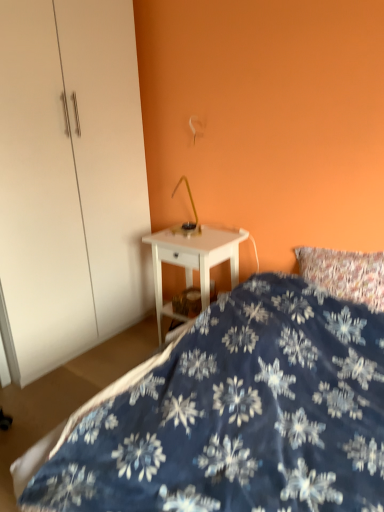
Question: Considering the relative sizes of white glossy dresser at center and blue fabric bed at lower right in the image provided, is white glossy dresser at center smaller than blue fabric bed at lower right?

Choices:
 (A) no
 (B) yes

Answer: (A)

Question: From the image's perspective, is white glossy dresser at center below blue fabric bed at lower right?

Choices:
 (A) yes
 (B) no

Answer: (B)

Question: Are white glossy dresser at center and blue fabric bed at lower right making contact?

Choices:
 (A) yes
 (B) no

Answer: (B)

Question: Is the depth of white glossy dresser at center less than that of blue fabric bed at lower right?

Choices:
 (A) yes
 (B) no

Answer: (B)

Question: Considering the relative sizes of white glossy dresser at center and blue fabric bed at lower right in the image provided, is white glossy dresser at center taller than blue fabric bed at lower right?

Choices:
 (A) no
 (B) yes

Answer: (B)

Question: Is white glossy nightstand at center wider or thinner than white glossy dresser at center?

Choices:
 (A) thin
 (B) wide

Answer: (A)

Question: From the image's perspective, is white glossy nightstand at center located above or below white glossy dresser at center?

Choices:
 (A) above
 (B) below

Answer: (B)

Question: In the image, is white glossy nightstand at center positioned in front of or behind white glossy dresser at center?

Choices:
 (A) front
 (B) behind

Answer: (B)

Question: In terms of height, does white glossy nightstand at center look taller or shorter compared to white glossy dresser at center?

Choices:
 (A) short
 (B) tall

Answer: (A)

Question: Looking at their shapes, would you say white glossy dresser at center is wider or thinner than blue fabric bed at lower right?

Choices:
 (A) thin
 (B) wide

Answer: (A)

Question: Looking at the image, does white glossy dresser at center seem bigger or smaller compared to blue fabric bed at lower right?

Choices:
 (A) big
 (B) small

Answer: (A)

Question: From the image's perspective, is white glossy dresser at center located above or below blue fabric bed at lower right?

Choices:
 (A) below
 (B) above

Answer: (B)

Question: Considering the positions of point [x=34, y=74] and point [x=228, y=485], is point [x=34, y=74] closer or farther from the camera than point [x=228, y=485]?

Choices:
 (A) farther
 (B) closer

Answer: (A)

Question: Considering the positions of white glossy dresser at center and white glossy nightstand at center in the image, is white glossy dresser at center taller or shorter than white glossy nightstand at center?

Choices:
 (A) short
 (B) tall

Answer: (B)

Question: Is white glossy dresser at center spatially inside white glossy nightstand at center, or outside of it?

Choices:
 (A) inside
 (B) outside

Answer: (B)